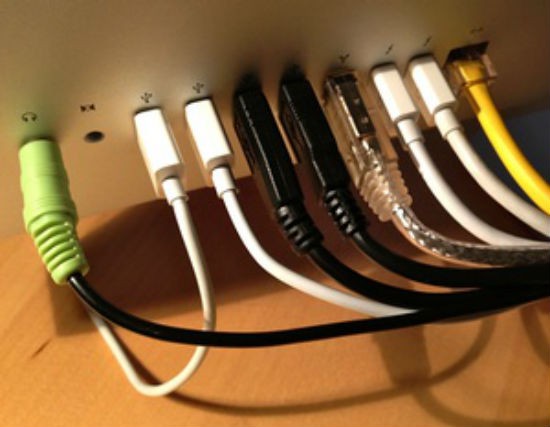
Image resolution: width=550 pixels, height=427 pixels. What are the coordinates of `white cables` in the screenshot? It's located at (152, 131), (200, 124), (387, 97), (433, 80).